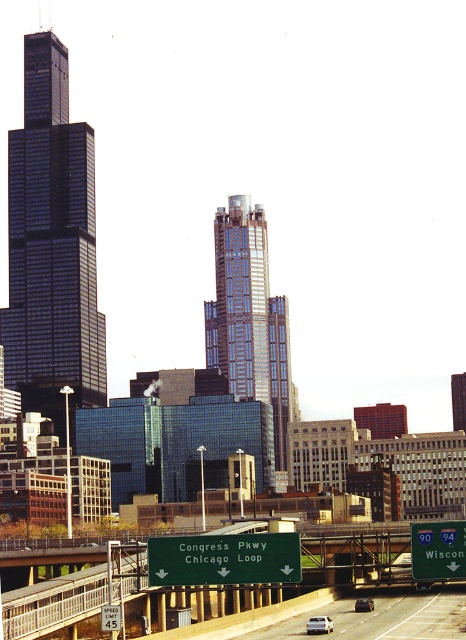
Does white asphalt highway at lower center come in front of white glossy sedan at center?

Yes.

Does white asphalt highway at lower center have a smaller size compared to white glossy sedan at center?

No.

The image size is (466, 640). In order to click on white asphalt highway at lower center in this screenshot , I will do `click(383, 618)`.

Who is higher up, white asphalt highway at lower center or metallic silver sedan at center?

Positioned higher is metallic silver sedan at center.

Can you confirm if white asphalt highway at lower center is smaller than metallic silver sedan at center?

Actually, white asphalt highway at lower center might be larger than metallic silver sedan at center.

The height and width of the screenshot is (640, 466). Find the location of `white asphalt highway at lower center`. white asphalt highway at lower center is located at coordinates (383, 618).

Is green matte street sign at center positioned behind green matte street sign at lower right?

No, green matte street sign at center is in front of green matte street sign at lower right.

Can you confirm if green matte street sign at center is wider than green matte street sign at lower right?

Indeed, green matte street sign at center has a greater width compared to green matte street sign at lower right.

Is point (247, 532) positioned behind point (424, 534)?

That is True.

At what (x,y) coordinates should I click in order to perform the action: click on green matte street sign at center. Please return your answer as a coordinate pair (x, y). Looking at the image, I should click on (224, 557).